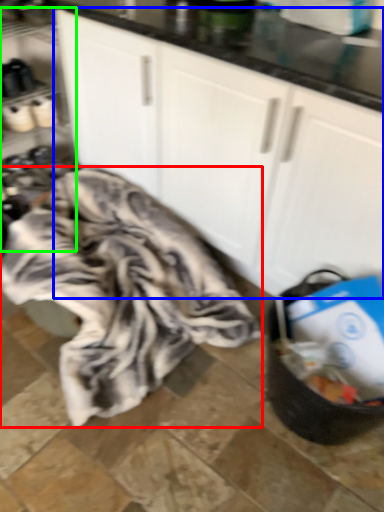
Question: Considering the real-world distances, which object is closest to blanket (highlighted by a red box)? cabinetry (highlighted by a blue box) or shelf (highlighted by a green box).

Choices:
 (A) cabinetry
 (B) shelf

Answer: (A)